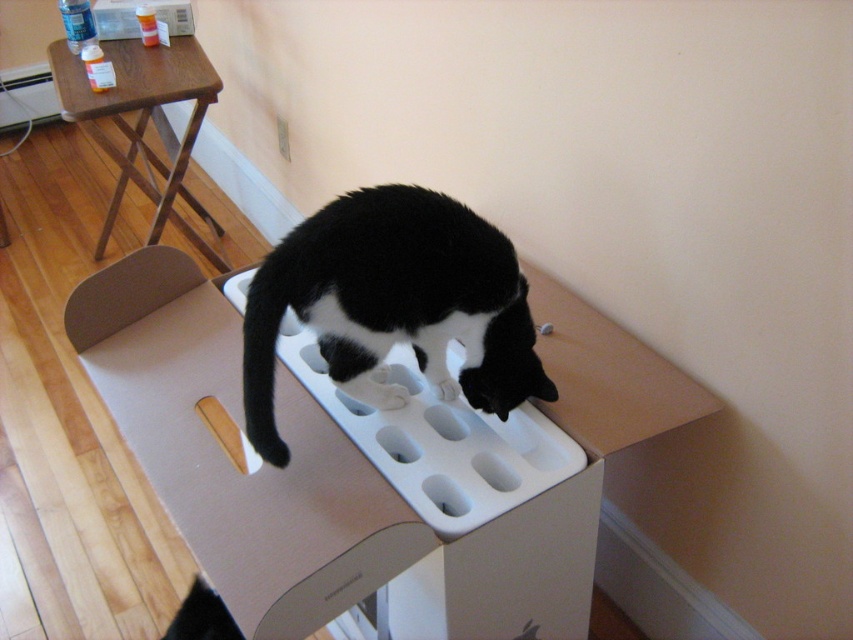
Question: Is black matte/object at center thinner than wooden step stool at upper left?

Choices:
 (A) yes
 (B) no

Answer: (A)

Question: Which of the following is the closest to the observer?

Choices:
 (A) (161, 100)
 (B) (517, 384)

Answer: (B)

Question: Observing the image, what is the correct spatial positioning of black matte/object at center in reference to wooden step stool at upper left?

Choices:
 (A) below
 (B) above

Answer: (A)

Question: Can you confirm if black matte/object at center is positioned to the right of wooden step stool at upper left?

Choices:
 (A) yes
 (B) no

Answer: (A)